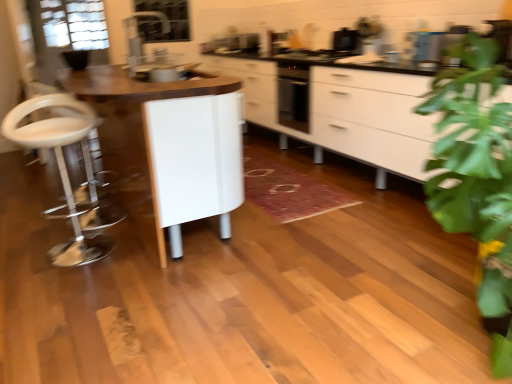
The width and height of the screenshot is (512, 384). Find the location of `free spot in front of white glossy swivel chair at left`. free spot in front of white glossy swivel chair at left is located at coordinates (60, 279).